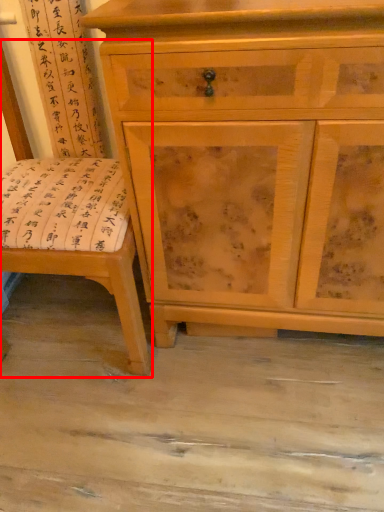
Question: In this image, where is swivel chair (annotated by the red box) located relative to chest of drawers?

Choices:
 (A) right
 (B) left

Answer: (B)